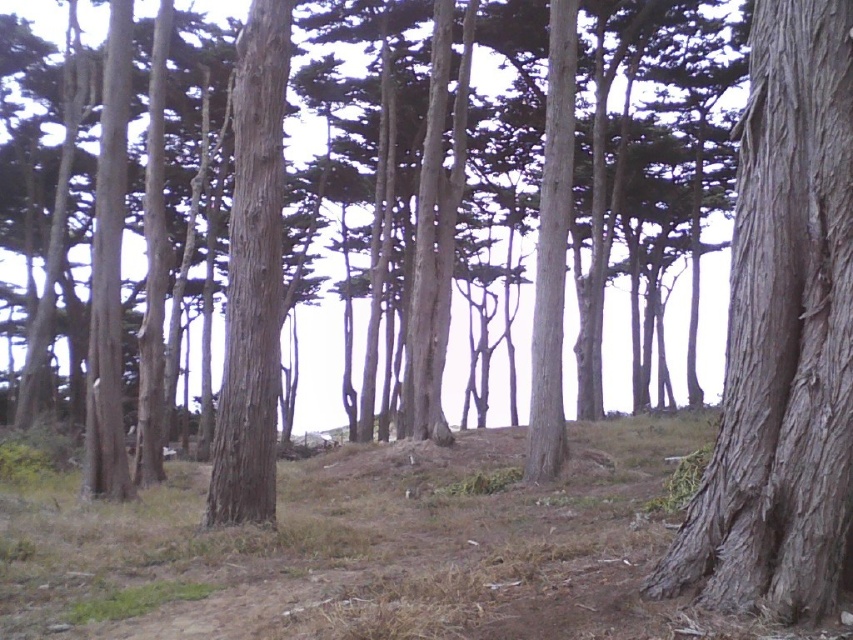
Question: Does gray rough bark tree trunk at center have a larger size compared to smooth bark tree at center?

Choices:
 (A) yes
 (B) no

Answer: (B)

Question: Which is nearer to the smooth brown tree trunk at center?

Choices:
 (A) smooth bark tree at center
 (B) gray rough bark tree trunk at center

Answer: (B)

Question: Among these points, which one is nearest to the camera?

Choices:
 (A) (730, 467)
 (B) (271, 170)
 (C) (527, 348)

Answer: (A)

Question: Can you confirm if gray rough bark tree trunk at center is bigger than smooth brown tree trunk at center?

Choices:
 (A) yes
 (B) no

Answer: (B)

Question: Is gray rough bark tree trunk at center wider than smooth bark tree at center?

Choices:
 (A) no
 (B) yes

Answer: (A)

Question: Among these points, which one is farthest from the camera?

Choices:
 (A) (207, 504)
 (B) (782, 112)
 (C) (703, 298)

Answer: (C)